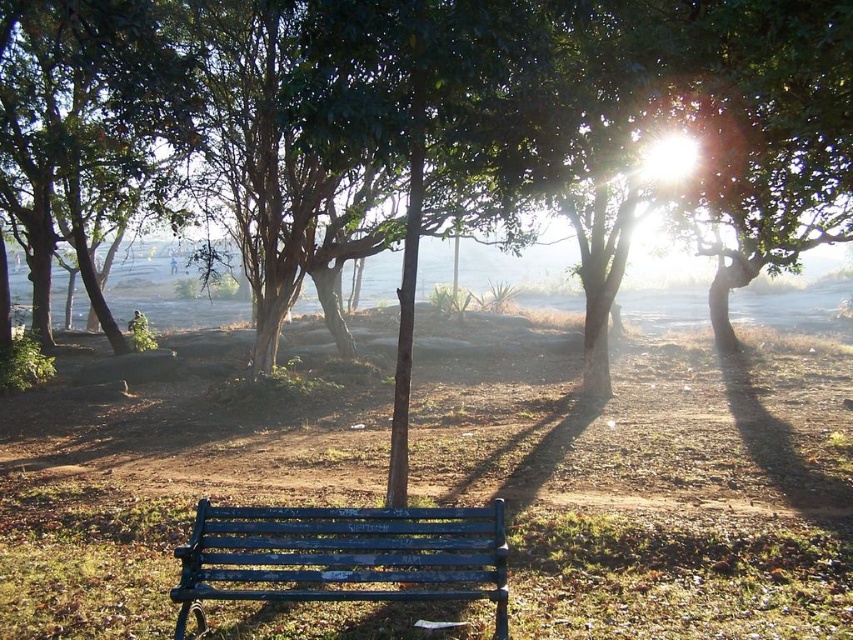
You are sitting on the blue painted wood bench at center and want to look at the tree. Which direction should you turn your head to see the green leafy tree at center?

The green leafy tree at center is positioned on the right side of the blue painted wood bench at center, so you should turn your head to the right to see it.

You are standing in the park and see the green grass at center and the blue painted wood bench at center. Which object is higher in the image?

The green grass at center is located above the blue painted wood bench at center, so the green grass at center is higher in the image.